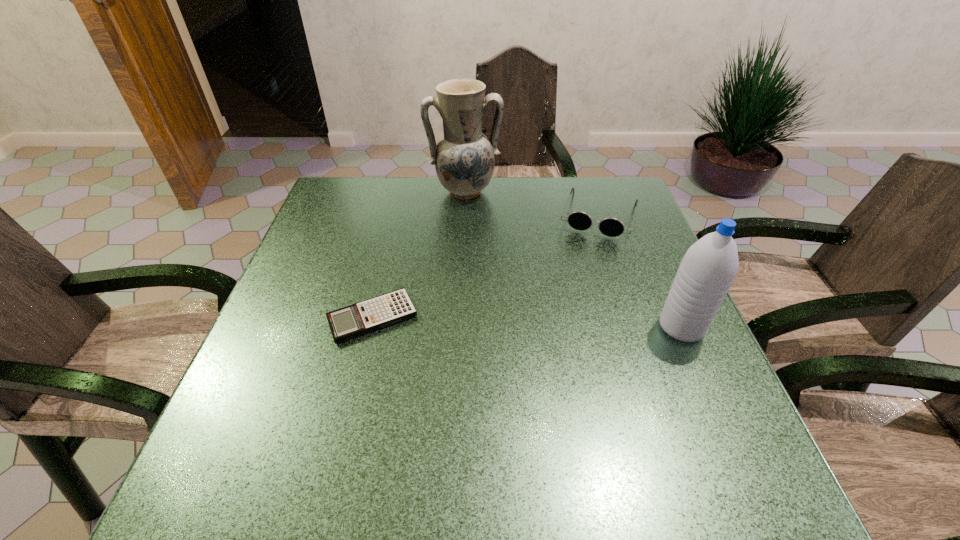
At what (x,y) coordinates should I click in order to perform the action: click on free spot between the pottery and the shortest object. Please return your answer as a coordinate pair (x, y). Looking at the image, I should click on coord(419,254).

Identify the location of free space that is in between the second tallest object and the calculator. The height and width of the screenshot is (540, 960). (527, 322).

Identify the location of vacant area that lies between the water bottle and the shortest object. This screenshot has height=540, width=960. (527, 322).

This screenshot has width=960, height=540. Find the location of `vacant region between the second shortest object and the water bottle`. vacant region between the second shortest object and the water bottle is located at coordinates (640, 272).

Image resolution: width=960 pixels, height=540 pixels. What are the coordinates of `blank region between the shortest object and the water bottle` in the screenshot? It's located at (527, 322).

The width and height of the screenshot is (960, 540). I want to click on object that is the third closest to the water bottle, so click(379, 312).

This screenshot has width=960, height=540. Identify the location of object that ranks as the second closest to the sunglasses. (707, 270).

Find the location of a particular element. This screenshot has width=960, height=540. free spot that satisfies the following two spatial constraints: 1. on the back side of the shortest object; 2. on the left side of the pottery is located at coordinates (402, 191).

Where is `blank space that satisfies the following two spatial constraints: 1. on the front side of the third shortest object; 2. on the left side of the third tallest object`? The width and height of the screenshot is (960, 540). blank space that satisfies the following two spatial constraints: 1. on the front side of the third shortest object; 2. on the left side of the third tallest object is located at coordinates (636, 327).

What are the coordinates of `vacant space that satisfies the following two spatial constraints: 1. on the back side of the shortest object; 2. on the right side of the pottery` in the screenshot? It's located at (402, 191).